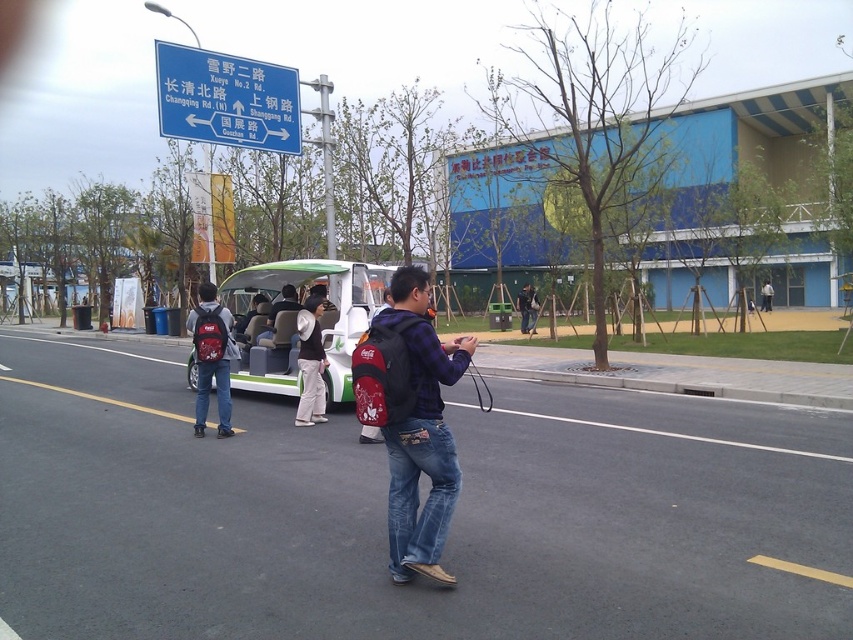
You are standing at the point with coordinates point (763, 296) and want to walk to the point with coordinates point (320, 376). Is there a clear path between these two points without any obstacles?

Point (320, 376) is in front of point (763, 296), so there is a clear path between them as the first point is closer to you than the second point.

From the picture: You are a photographer standing in the urban street scene. You notice the white cotton hat at center and the denim jacket at center. Which object is taller when viewed from your position?

The white cotton hat at center is taller than the denim jacket at center.